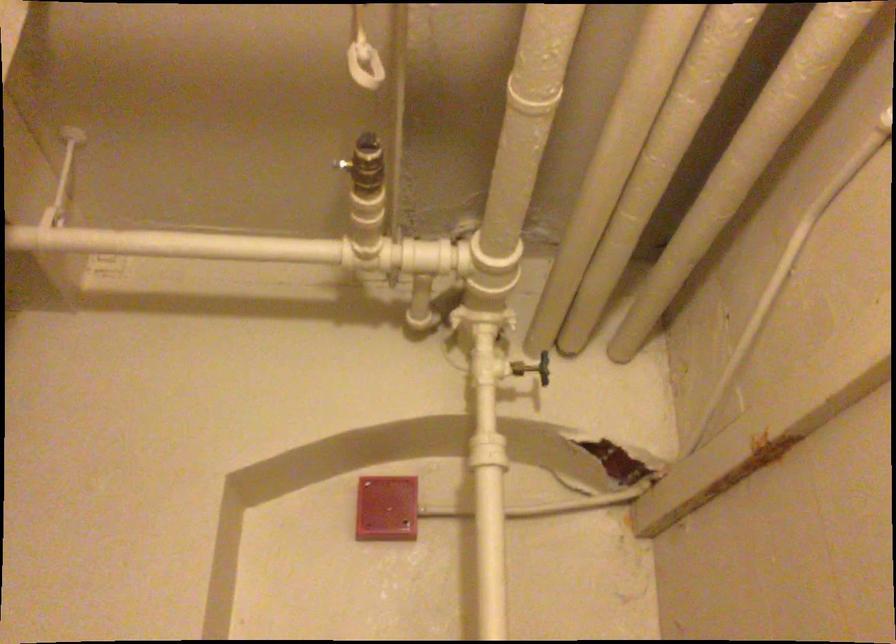
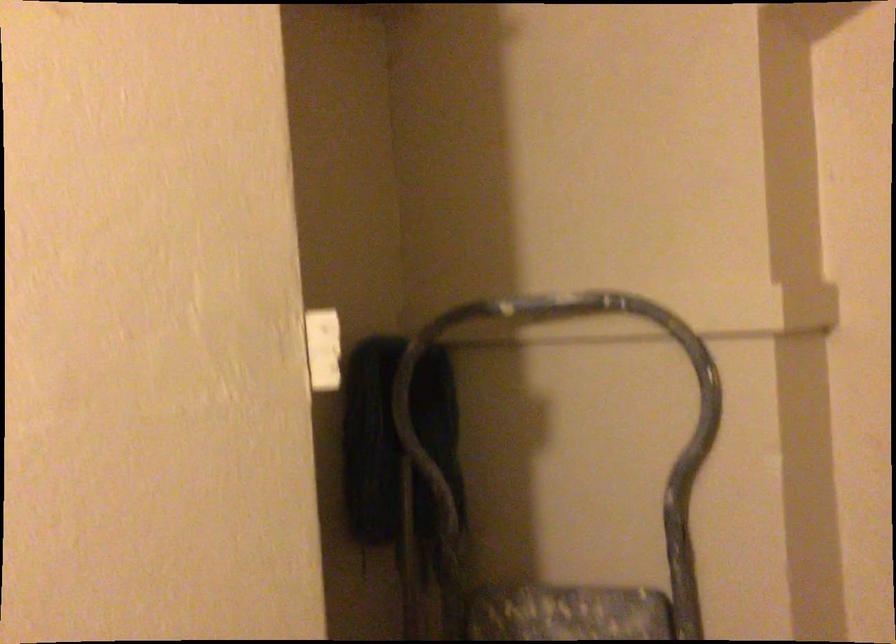
From the picture: First-person continuous shooting, in which direction is the camera rotating?

The camera rotated toward left-down.